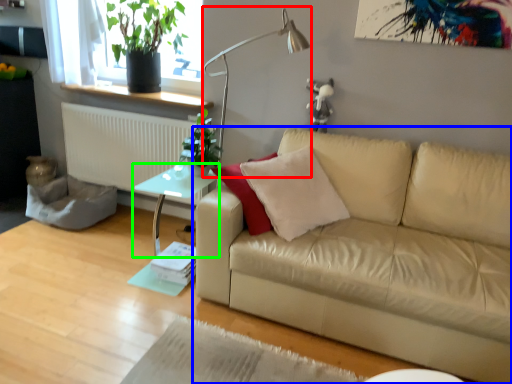
Question: Which object is positioned closest to table lamp (highlighted by a red box)? Select from studio couch (highlighted by a blue box) and table (highlighted by a green box).

Choices:
 (A) studio couch
 (B) table

Answer: (B)